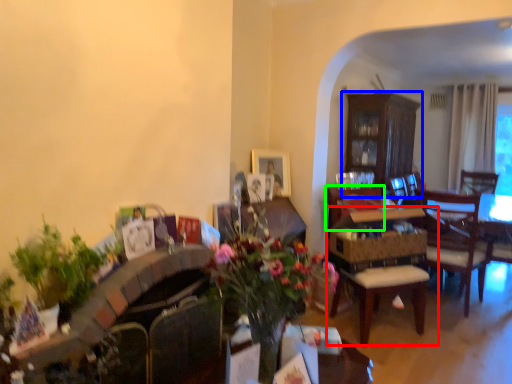
Question: Based on their relative distances, which object is farther from chair (highlighted by a red box)? Choose from cabinetry (highlighted by a blue box) and armchair (highlighted by a green box).

Choices:
 (A) cabinetry
 (B) armchair

Answer: (A)